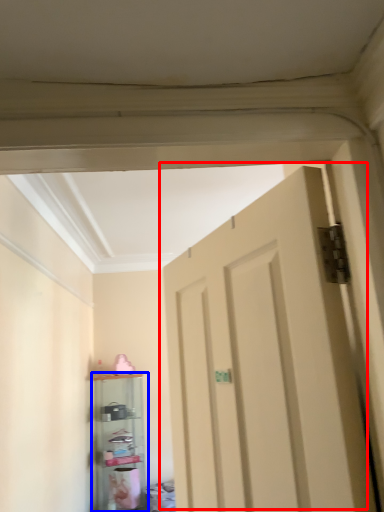
Question: Which object is further to the camera taking this photo, door (highlighted by a red box) or shelf (highlighted by a blue box)?

Choices:
 (A) door
 (B) shelf

Answer: (B)